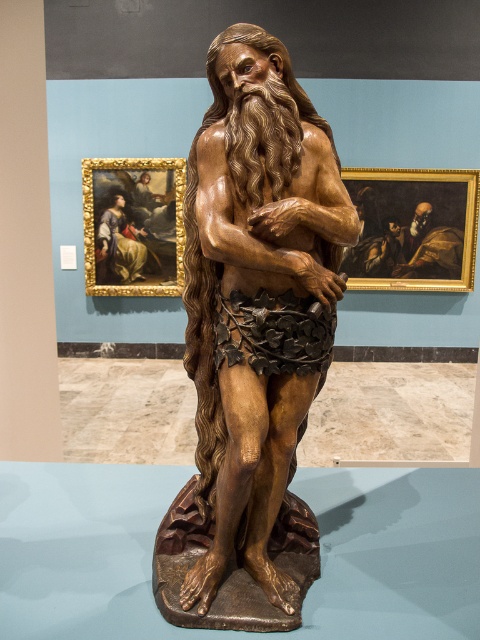
Question: Which object is positioned closest to the oil painting at upper left?

Choices:
 (A) bronze statue at center
 (B) dark brown wood painting at right

Answer: (B)

Question: Which of these objects is positioned farthest from the oil painting at upper left?

Choices:
 (A) dark brown wood painting at right
 (B) bronze statue at center

Answer: (B)

Question: Is the position of bronze statue at center more distant than that of oil painting at upper left?

Choices:
 (A) yes
 (B) no

Answer: (B)

Question: Is bronze statue at center below oil painting at upper left?

Choices:
 (A) yes
 (B) no

Answer: (A)

Question: Does dark brown wood painting at right lie in front of oil painting at upper left?

Choices:
 (A) yes
 (B) no

Answer: (A)

Question: Which object appears farthest from the camera in this image?

Choices:
 (A) dark brown wood painting at right
 (B) bronze statue at center

Answer: (A)